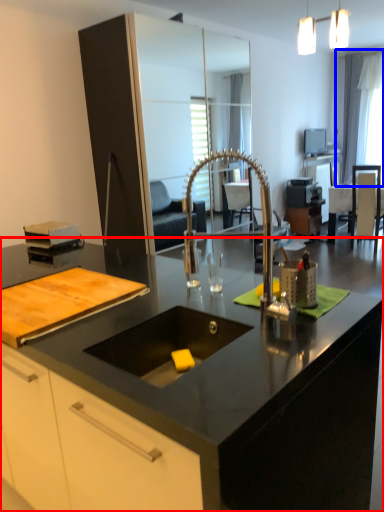
Question: Which object is further to the camera taking this photo, countertop (highlighted by a red box) or window screen (highlighted by a blue box)?

Choices:
 (A) countertop
 (B) window screen

Answer: (B)